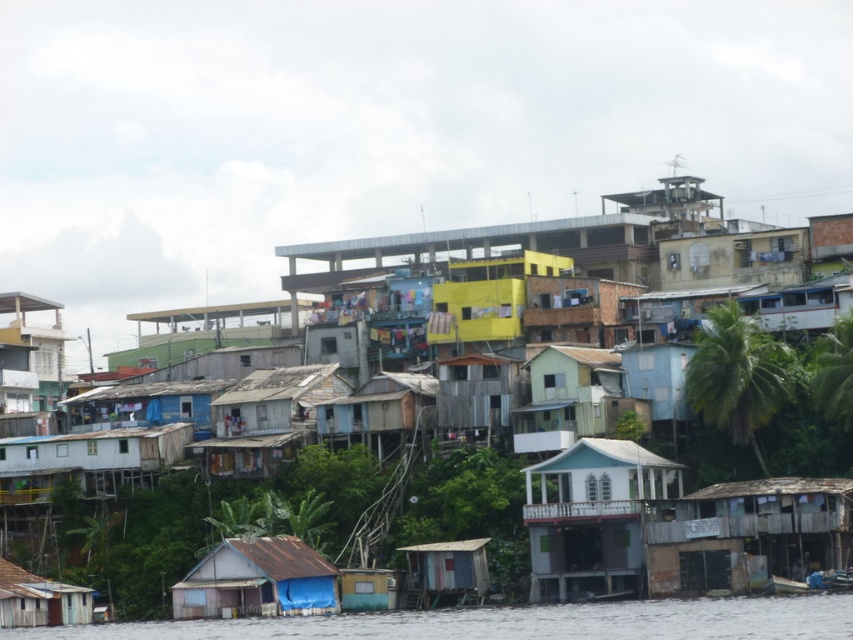
What do you see at coordinates (746, 534) in the screenshot? I see `weathered wood shack at lower right` at bounding box center [746, 534].

You are a GUI agent. You are given a task and a screenshot of the screen. Output one action in this format:
    pyautogui.click(x=<x>, y=<y>)
    Task: Click on the weathered wood shack at lower right
    
    Given the screenshot: What is the action you would take?
    pyautogui.click(x=746, y=534)

Between transparent plastic water at lower center and wooden hut at lower left, which one appears on the right side from the viewer's perspective?

transparent plastic water at lower center

This screenshot has width=853, height=640. In order to click on transparent plastic water at lower center in this screenshot , I will do `click(514, 621)`.

Does white wood house at center lie behind wooden hut at lower left?

No, white wood house at center is closer to the viewer.

Does point (540, 573) lie behind point (21, 618)?

No.

Image resolution: width=853 pixels, height=640 pixels. What do you see at coordinates (592, 516) in the screenshot?
I see `white wood house at center` at bounding box center [592, 516].

This screenshot has width=853, height=640. I want to click on white wood house at center, so click(592, 516).